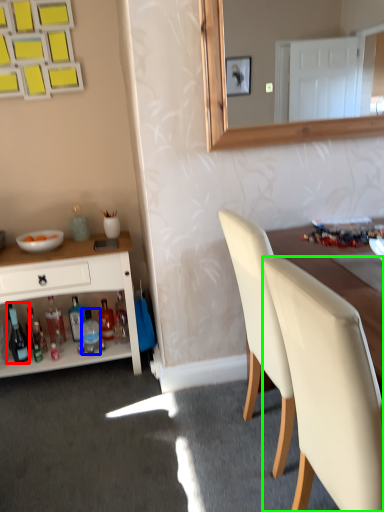
Question: Based on their relative distances, which object is farther from bottle (highlighted by a red box)? Choose from bottle (highlighted by a blue box) and chair (highlighted by a green box).

Choices:
 (A) bottle
 (B) chair

Answer: (B)